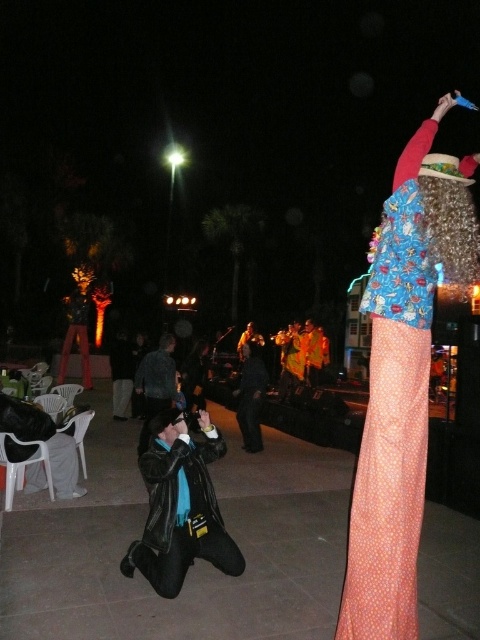
Can you confirm if polka dot fabric dress at right is positioned below denim jacket at center?

Incorrect, polka dot fabric dress at right is not positioned below denim jacket at center.

Which is behind, point (383, 515) or point (144, 406)?

The point (144, 406) is behind.

Where is `polka dot fabric dress at right`? Image resolution: width=480 pixels, height=640 pixels. polka dot fabric dress at right is located at coordinates (404, 380).

Find the location of a particular element. Image resolution: width=480 pixels, height=640 pixels. polka dot fabric dress at right is located at coordinates (404, 380).

Based on the photo, is polka dot fabric dress at right positioned before black leather jacket at lower center?

Yes, polka dot fabric dress at right is closer to the viewer.

Does polka dot fabric dress at right have a greater width compared to black leather jacket at lower center?

No.

Locate an element on the screen. polka dot fabric dress at right is located at coordinates (404, 380).

Where is `polka dot fabric dress at right`? This screenshot has height=640, width=480. polka dot fabric dress at right is located at coordinates (404, 380).

Can you confirm if dark blue leather jacket at center is smaller than yellow fabric pants at center?

No, dark blue leather jacket at center is not smaller than yellow fabric pants at center.

Who is lower down, dark blue leather jacket at center or yellow fabric pants at center?

dark blue leather jacket at center is below.

Between point (243, 412) and point (316, 328), which one is positioned in front?

Point (243, 412)

This screenshot has height=640, width=480. Identify the location of dark blue leather jacket at center. (251, 396).